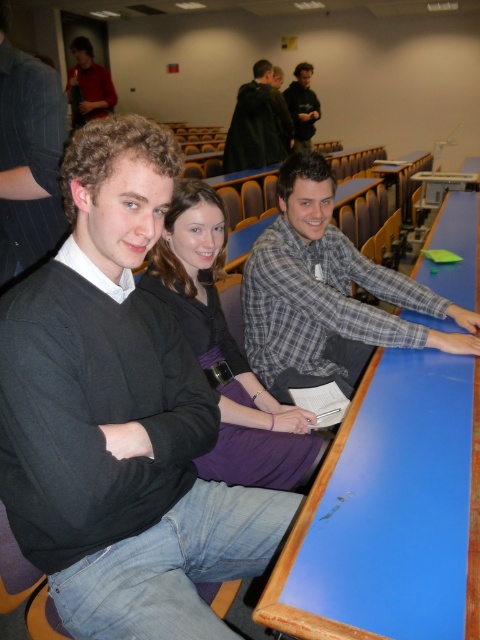
Does plaid shirt at center have a larger size compared to purple fabric dress at center?

Yes, plaid shirt at center is bigger than purple fabric dress at center.

Can you confirm if plaid shirt at center is positioned above purple fabric dress at center?

Yes, plaid shirt at center is above purple fabric dress at center.

Between point (287, 342) and point (301, 481), which one is positioned in front?

Point (301, 481) is more forward.

At what (x,y) coordinates should I click in order to perform the action: click on plaid shirt at center. Please return your answer as a coordinate pair (x, y). This screenshot has height=640, width=480. Looking at the image, I should click on (326, 294).

Who is lower down, blue glossy table at center or matte black sweater at upper left?

blue glossy table at center is lower down.

From the picture: Who is more forward, (304, 602) or (80, 64)?

Point (304, 602) is more forward.

The width and height of the screenshot is (480, 640). What are the coordinates of `blue glossy table at center` in the screenshot? It's located at (389, 509).

Based on the photo, between blue glossy table at center and dark brown leather jacket at upper center, which one appears on the left side from the viewer's perspective?

From the viewer's perspective, dark brown leather jacket at upper center appears more on the left side.

Is point (444, 365) farther from viewer compared to point (243, 109)?

No, (444, 365) is in front of (243, 109).

The height and width of the screenshot is (640, 480). Identify the location of blue glossy table at center. (389, 509).